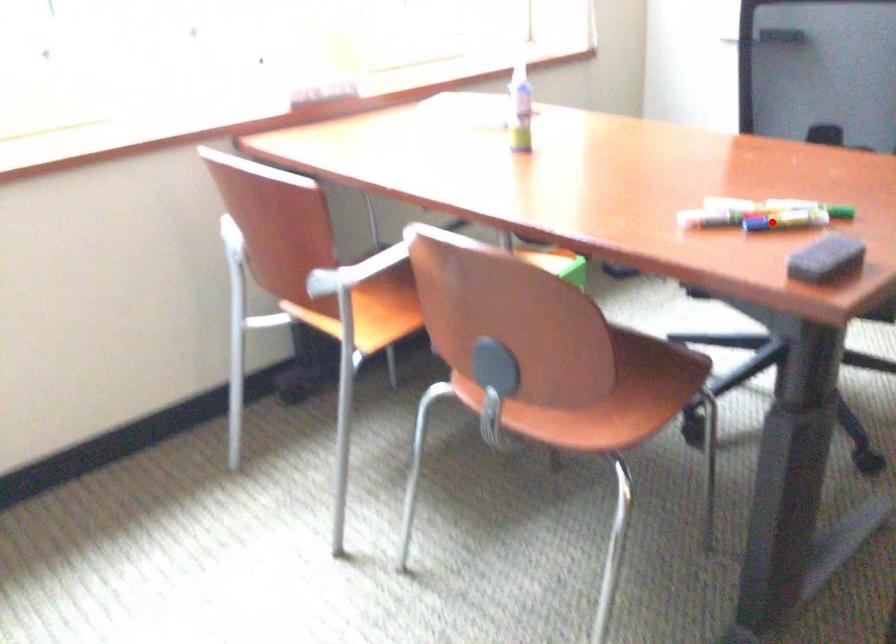
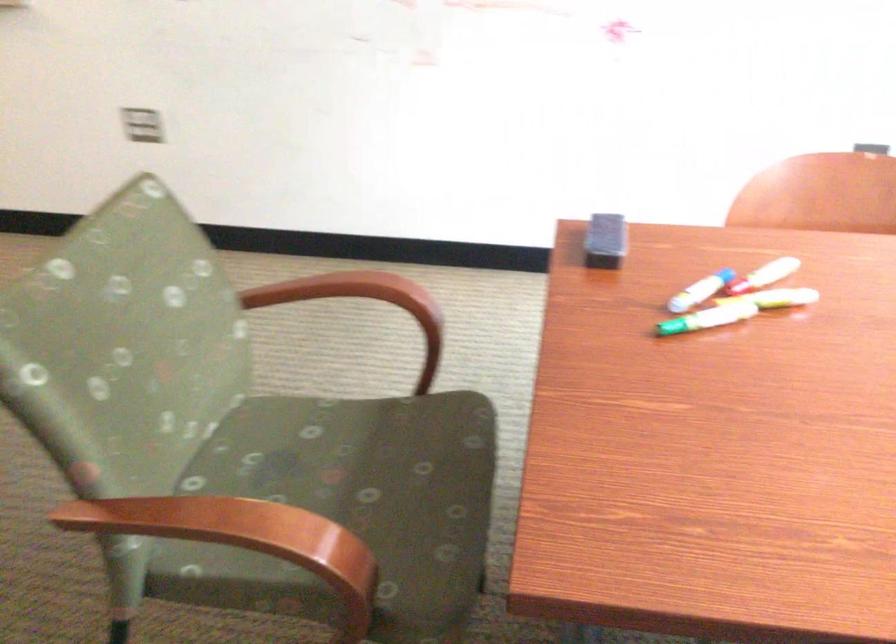
Question: I am providing you with two images of the same scene from different viewpoints. In image1, a red point is highlighted. Considering the same 3D point in image2, which of the following is correct?

Choices:
 (A) It is closer
 (B) It is farther

Answer: (A)